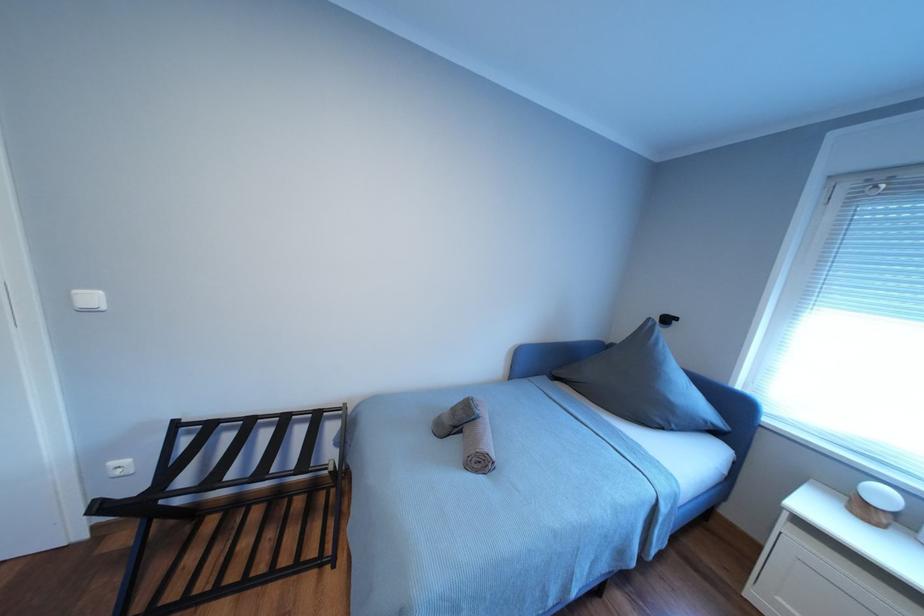
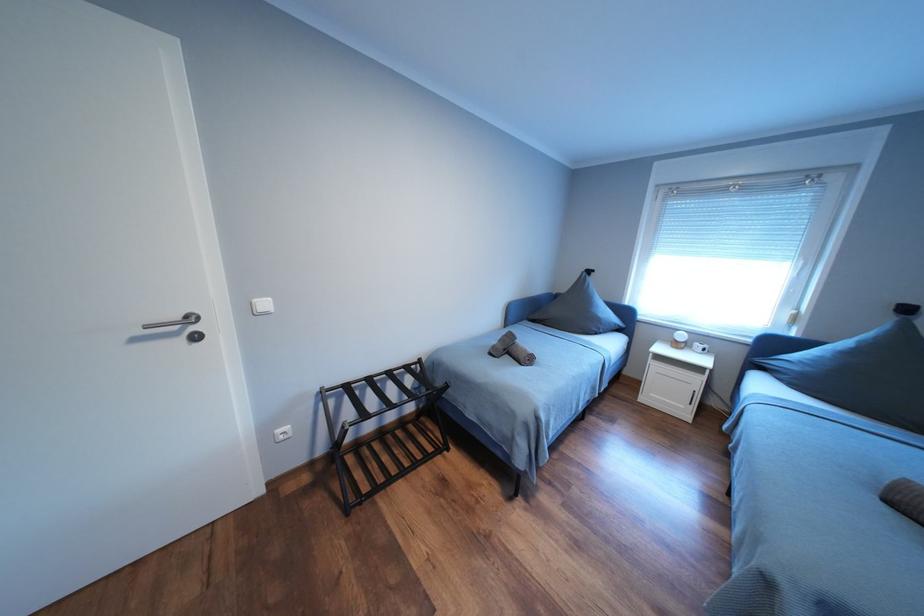
Question: The images are taken continuously from a first-person perspective. In which direction is your viewpoint rotating?

Choices:
 (A) Left
 (B) Right
 (C) Up
 (D) Down

Answer: (B)